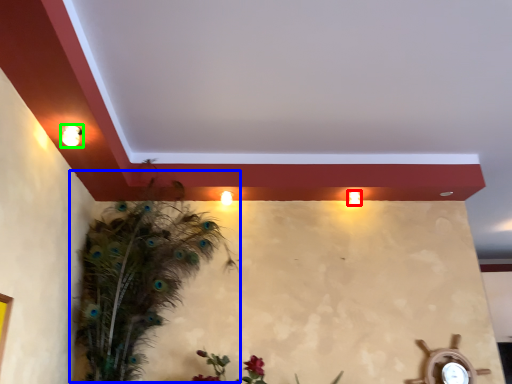
Question: Considering the real-world distances, which object is closest to light (highlighted by a red box)? bird (highlighted by a blue box) or light fixture (highlighted by a green box).

Choices:
 (A) bird
 (B) light fixture

Answer: (A)